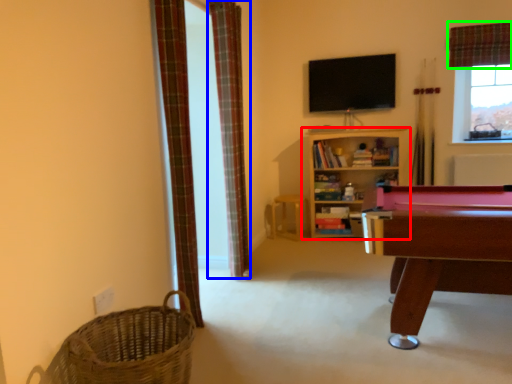
Question: Based on their relative distances, which object is nearer to shelf (highlighted by a red box)? Choose from curtain (highlighted by a blue box) and curtain (highlighted by a green box).

Choices:
 (A) curtain
 (B) curtain

Answer: (B)